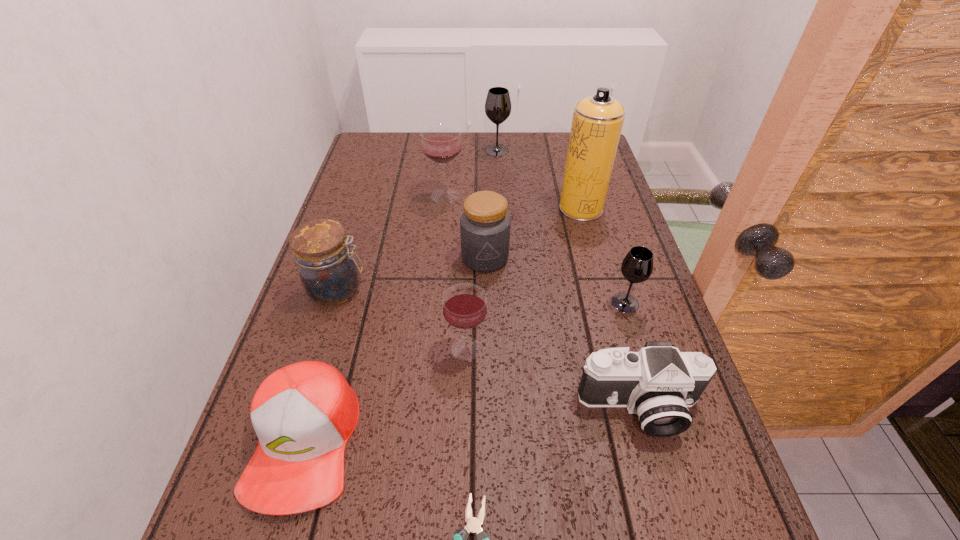
In order to click on blank area located 0.060m on the back of the second nearest wineglass in this screenshot , I will do `click(616, 275)`.

Locate an element on the screen. The width and height of the screenshot is (960, 540). vacant space situated 0.350m on the left of the camera is located at coordinates (391, 408).

Locate an element on the screen. The height and width of the screenshot is (540, 960). object that is at the far edge is located at coordinates (498, 104).

Locate an element on the screen. Image resolution: width=960 pixels, height=540 pixels. jar located at the left edge is located at coordinates (328, 272).

Identify the location of baseball cap located at the left edge. (304, 414).

This screenshot has width=960, height=540. Find the location of `aerosol can present at the right edge`. aerosol can present at the right edge is located at coordinates (597, 122).

The width and height of the screenshot is (960, 540). What are the coordinates of `wineglass positioned at the right edge` in the screenshot? It's located at (637, 266).

This screenshot has height=540, width=960. What are the coordinates of `camera present at the right edge` in the screenshot? It's located at (658, 383).

Identify the location of free location at the far edge. Image resolution: width=960 pixels, height=540 pixels. (501, 168).

Identify the location of free space between the red baseball cap and the third wineglass from left to right. (400, 296).